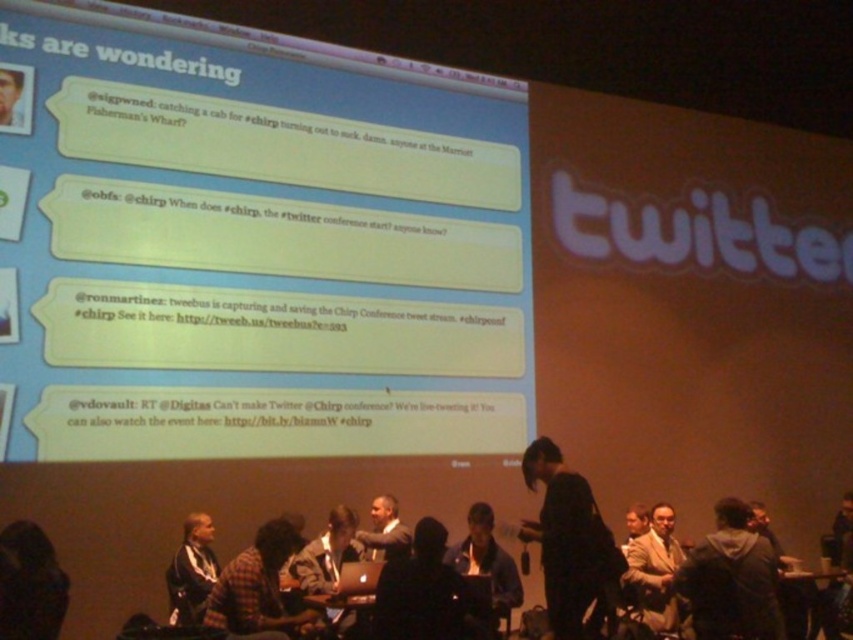
From the picture: You are a conference attendee looking for the live stream link. You see the presentation screen with the dark gray fabric jacket at center and the smooth skin face at upper left. Which object is positioned higher on the screen?

The smooth skin face at upper left is positioned higher on the screen than the dark gray fabric jacket at center.

You are attending the Chirp Conference and see the presentation screen with the black matte dress at center and the plaid shirt at center. Which clothing item is located to the right of the other?

The black matte dress at center is positioned on the right side of plaid shirt at center, so the black matte dress at center is to the right of the plaid shirt at center.